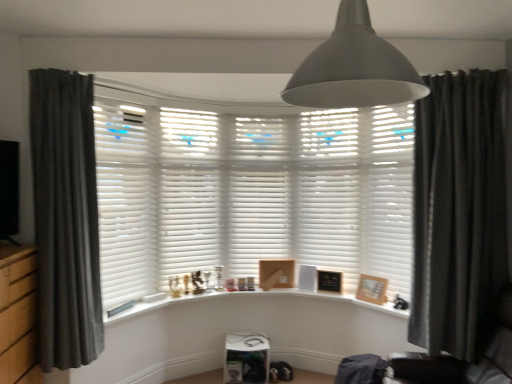
Question: Can you confirm if wooden picture frame at right, arranged as the 3th picture frame when viewed from the back, is bigger than white wood window sill at center?

Choices:
 (A) yes
 (B) no

Answer: (B)

Question: Is wooden picture frame at right, which is the 1th picture frame in right-to-left order, thinner than white wood window sill at center?

Choices:
 (A) yes
 (B) no

Answer: (A)

Question: Is wooden picture frame at right, which is the 1th picture frame in right-to-left order, in contact with white wood window sill at center?

Choices:
 (A) yes
 (B) no

Answer: (B)

Question: Considering the relative positions of wooden picture frame at right, which is the 1th picture frame in right-to-left order, and white wood window sill at center in the image provided, is wooden picture frame at right, which is the 1th picture frame in right-to-left order, in front of white wood window sill at center?

Choices:
 (A) no
 (B) yes

Answer: (A)

Question: Does wooden picture frame at right, which ranks as the third picture frame in left-to-right order, have a lesser height compared to white wood window sill at center?

Choices:
 (A) no
 (B) yes

Answer: (A)

Question: From the image's perspective, is wooden picture frame at right, which is counted as the 1th picture frame, starting from the front, over white wood window sill at center?

Choices:
 (A) no
 (B) yes

Answer: (B)

Question: From a real-world perspective, is black leather swivel chair at lower right on matte gray lampshade at upper center?

Choices:
 (A) no
 (B) yes

Answer: (A)

Question: Could matte gray lampshade at upper center be considered to be inside black leather swivel chair at lower right?

Choices:
 (A) yes
 (B) no

Answer: (B)

Question: Considering the relative sizes of black leather swivel chair at lower right and matte gray lampshade at upper center in the image provided, is black leather swivel chair at lower right shorter than matte gray lampshade at upper center?

Choices:
 (A) yes
 (B) no

Answer: (B)

Question: Is black leather swivel chair at lower right oriented away from matte gray lampshade at upper center?

Choices:
 (A) yes
 (B) no

Answer: (B)

Question: Are black leather swivel chair at lower right and matte gray lampshade at upper center beside each other?

Choices:
 (A) no
 (B) yes

Answer: (A)

Question: Is black leather swivel chair at lower right positioned in front of matte gray lampshade at upper center?

Choices:
 (A) no
 (B) yes

Answer: (A)

Question: Is dark grey fabric curtain at left, which ranks as the second curtain in right-to-left order, positioned with its back to black leather swivel chair at lower right?

Choices:
 (A) yes
 (B) no

Answer: (B)